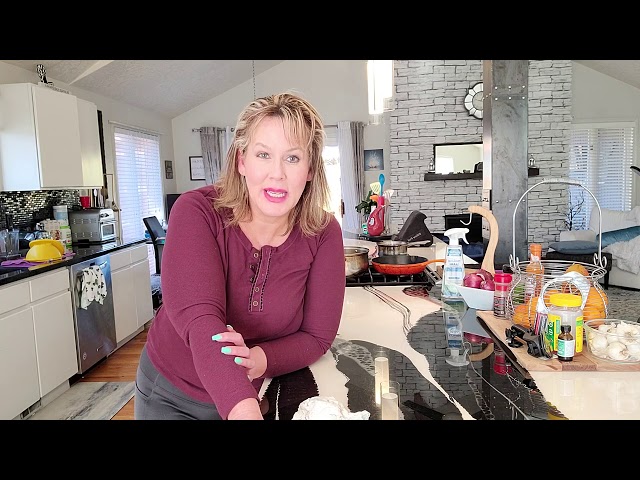
Image resolution: width=640 pixels, height=480 pixels. What are the coordinates of `dishwasher` in the screenshot? It's located at (93, 340).